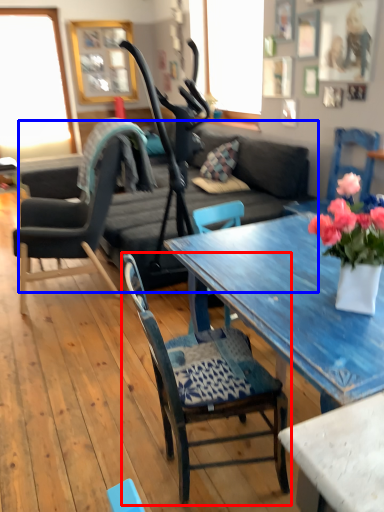
Question: Which object appears farthest to the camera in this image, chair (highlighted by a red box) or studio couch (highlighted by a blue box)?

Choices:
 (A) chair
 (B) studio couch

Answer: (B)